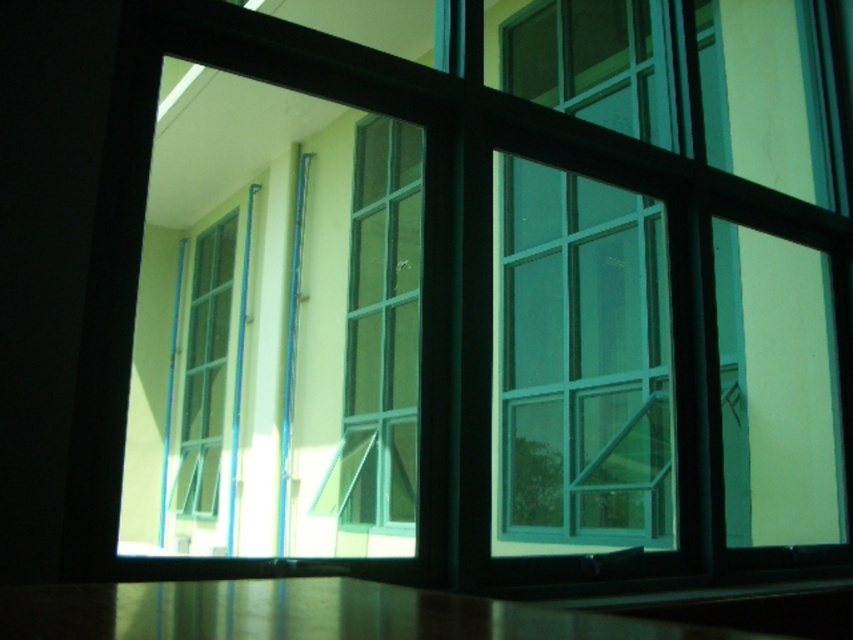
Question: Which of the following is the farthest from the observer?

Choices:
 (A) (448, 634)
 (B) (357, 266)

Answer: (B)

Question: Is metallic polished table at lower center closer to the viewer compared to clear glass window at center?

Choices:
 (A) yes
 (B) no

Answer: (A)

Question: Does metallic polished table at lower center have a larger size compared to clear glass window at center?

Choices:
 (A) yes
 (B) no

Answer: (B)

Question: Which of the following is the farthest from the observer?

Choices:
 (A) (373, 131)
 (B) (480, 600)

Answer: (A)

Question: Can you confirm if metallic polished table at lower center is positioned above clear glass window at center?

Choices:
 (A) no
 (B) yes

Answer: (A)

Question: Which point is closer to the camera?

Choices:
 (A) clear glass window at center
 (B) metallic polished table at lower center

Answer: (B)